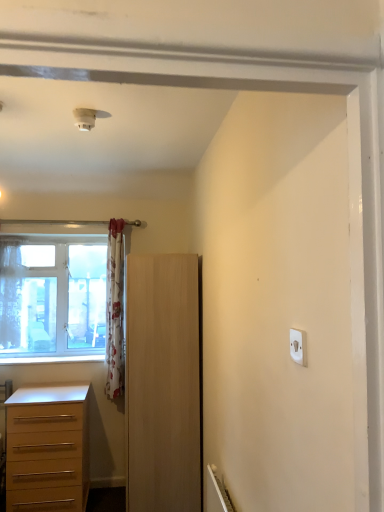
Question: Considering the relative positions of floral fabric curtain at left, which is the 1th curtain in right-to-left order, and light brown wooden chest of drawers at lower left in the image provided, is floral fabric curtain at left, which is the 1th curtain in right-to-left order, to the left or to the right of light brown wooden chest of drawers at lower left?

Choices:
 (A) left
 (B) right

Answer: (B)

Question: In the image, is floral fabric curtain at left, arranged as the second curtain when viewed from the left, positioned in front of or behind light brown wooden chest of drawers at lower left?

Choices:
 (A) behind
 (B) front

Answer: (A)

Question: Estimate the real-world distances between objects in this image. Which object is closer to the white painted wood at lower left?

Choices:
 (A) sheer floral fabric curtain at left, arranged as the first curtain when viewed from the left
 (B) light wood cupboard at center
 (C) white plastic light switch at upper right
 (D) clear glass window at left
 (E) light brown wooden chest of drawers at lower left

Answer: (A)

Question: Estimate the real-world distances between objects in this image. Which object is closer to the light wood cupboard at center?

Choices:
 (A) clear glass window at left
 (B) sheer floral fabric curtain at left, which ranks as the 2th curtain in right-to-left order
 (C) floral fabric curtain at left, which is the 1th curtain in right-to-left order
 (D) light brown wooden chest of drawers at lower left
 (E) white painted wood at lower left

Answer: (D)